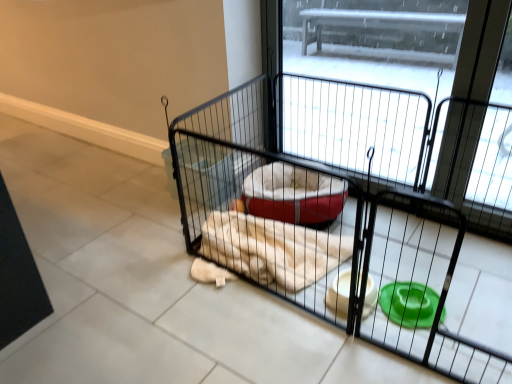
Identify the location of vacant area that lies in front of black wire screen door at center. The image size is (512, 384). (376, 268).